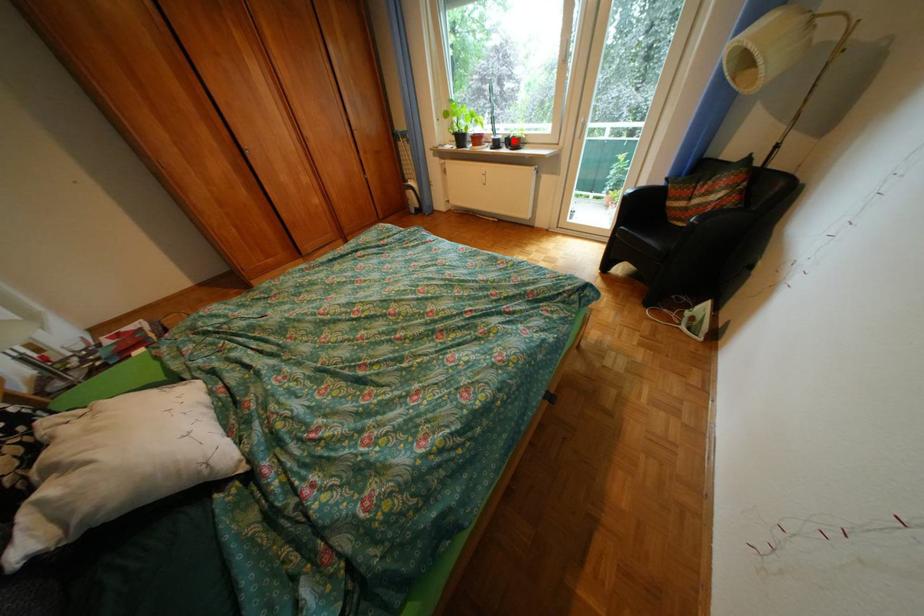
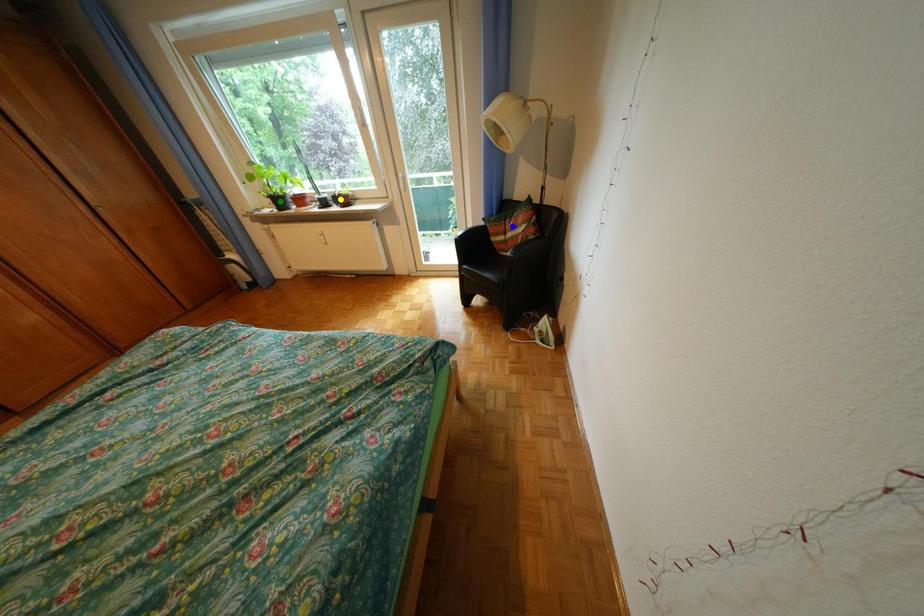
Question: I am providing you with two images of the same scene from different viewpoints. A red point is marked on the first image. You are given multiple points on the second image. Which spot in image 2 lines up with the point in image 1?

Choices:
 (A) green point
 (B) yellow point
 (C) blue point

Answer: (B)